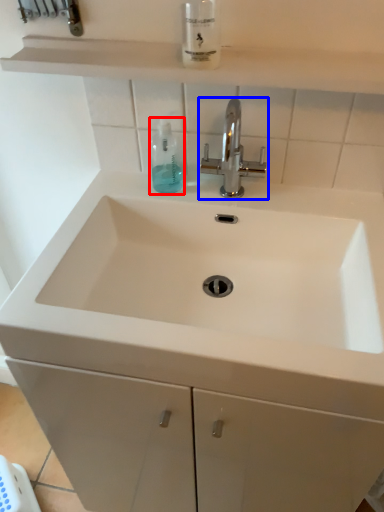
Question: Among these objects, which one is farthest to the camera, mouthwash (highlighted by a red box) or tap (highlighted by a blue box)?

Choices:
 (A) mouthwash
 (B) tap

Answer: (A)